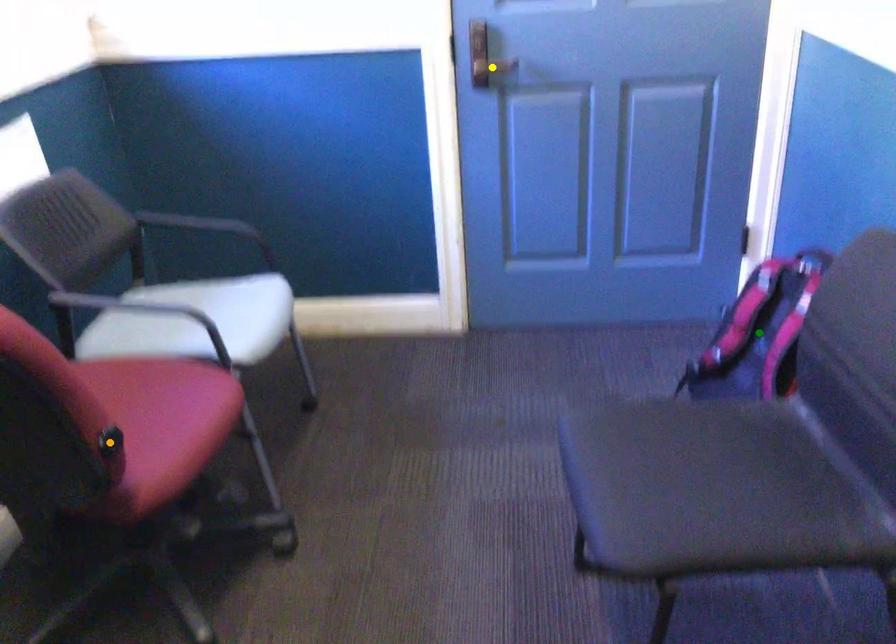
Order these from nearest to farthest:
A) yellow point
B) orange point
C) green point

1. yellow point
2. green point
3. orange point